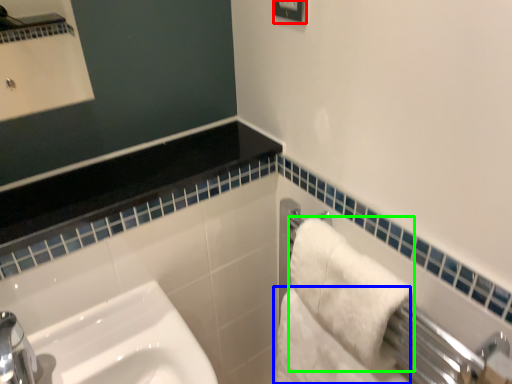
Question: Which object is positioned farthest from square (highlighted by a red box)? Select from bath towel (highlighted by a blue box) and bath towel (highlighted by a green box).

Choices:
 (A) bath towel
 (B) bath towel

Answer: (A)